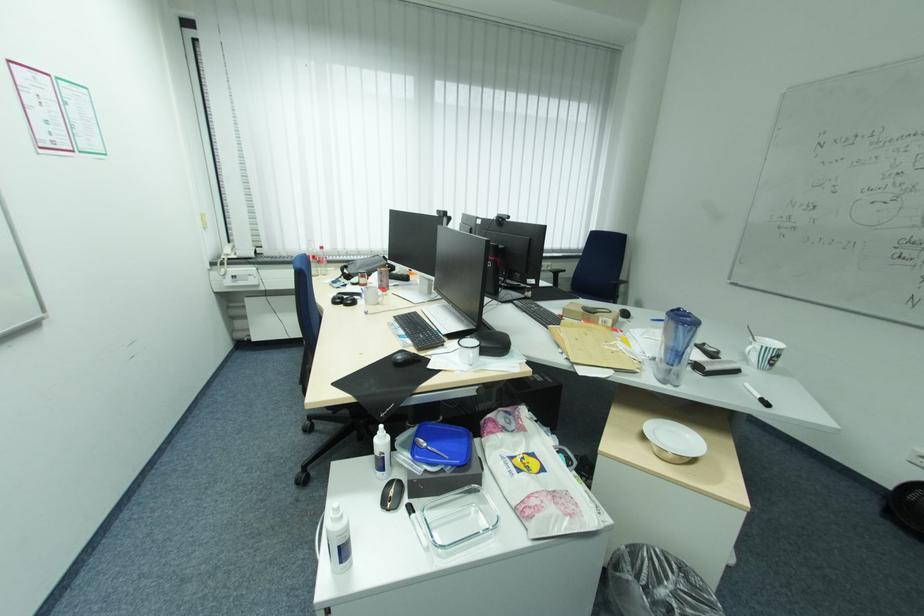
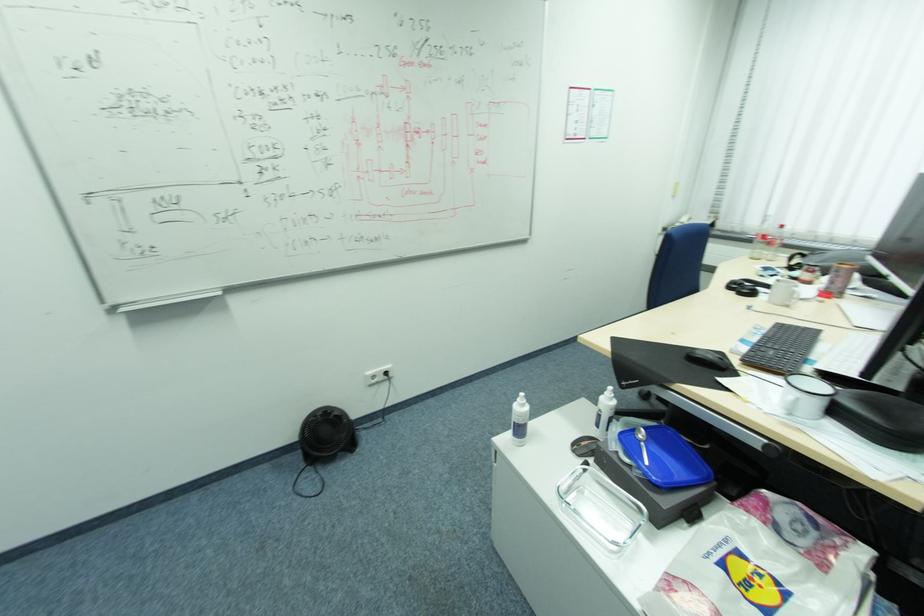
Locate, in the second image, the point that corresponds to point (383, 434) in the first image.

(612, 392)